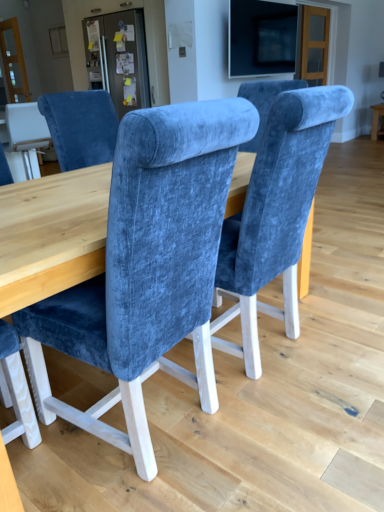
Question: Is there a large distance between velvet blue chair at center and matte wood table at right?

Choices:
 (A) no
 (B) yes

Answer: (B)

Question: Does velvet blue chair at center have a greater width compared to matte wood table at right?

Choices:
 (A) no
 (B) yes

Answer: (B)

Question: From the image's perspective, would you say velvet blue chair at center is positioned over matte wood table at right?

Choices:
 (A) yes
 (B) no

Answer: (B)

Question: Is velvet blue chair at center outside of matte wood table at right?

Choices:
 (A) no
 (B) yes

Answer: (B)

Question: Is velvet blue chair at center behind matte wood table at right?

Choices:
 (A) yes
 (B) no

Answer: (B)

Question: Can you confirm if velvet blue chair at center is thinner than matte wood table at right?

Choices:
 (A) no
 (B) yes

Answer: (A)

Question: From a real-world perspective, is matte wood table at right physically above matte black screen at upper center?

Choices:
 (A) no
 (B) yes

Answer: (A)

Question: Considering the relative sizes of matte wood table at right and matte black screen at upper center in the image provided, is matte wood table at right thinner than matte black screen at upper center?

Choices:
 (A) yes
 (B) no

Answer: (B)

Question: Is matte wood table at right not close to matte black screen at upper center?

Choices:
 (A) yes
 (B) no

Answer: (A)

Question: Does matte wood table at right appear on the right side of matte black screen at upper center?

Choices:
 (A) yes
 (B) no

Answer: (A)

Question: Can you see matte wood table at right touching matte black screen at upper center?

Choices:
 (A) no
 (B) yes

Answer: (A)

Question: From the image's perspective, would you say matte wood table at right is shown under matte black screen at upper center?

Choices:
 (A) no
 (B) yes

Answer: (B)

Question: Is matte wood table at right behind velvet blue chair at center?

Choices:
 (A) yes
 (B) no

Answer: (A)